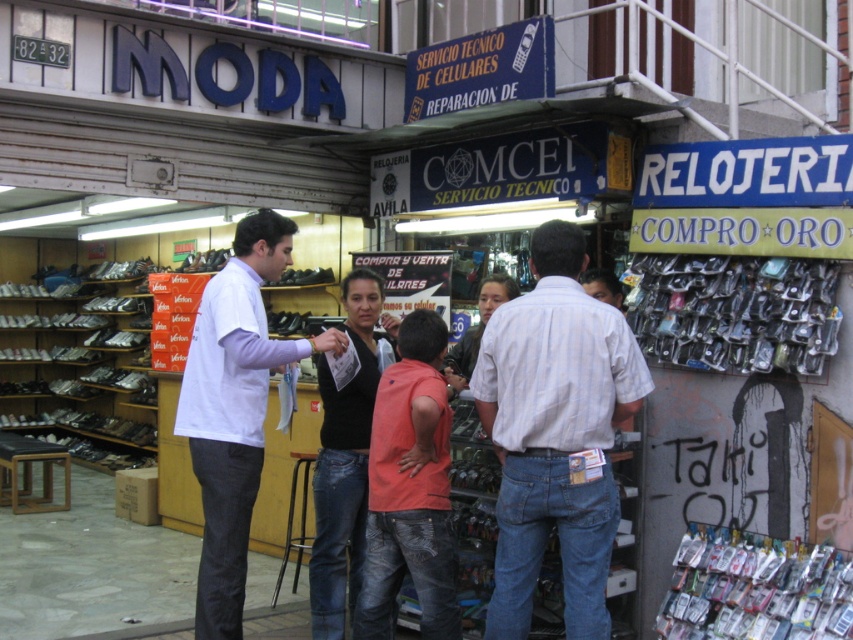
You are a customer at the MODA shop and want to buy a shirt. You see both the striped cotton shirt at center and the white cotton shirt at center. Which shirt takes up more space on the shelf?

The white cotton shirt at center takes up more space than the striped cotton shirt at center because the striped cotton shirt at center occupies less space than white cotton shirt at center.

Consider the image. You are a customer trying to decide between the white cotton shirt at center and the black matte shirt at center displayed in the shop window. Which shirt takes up more horizontal space?

The white cotton shirt at center might be wider than black matte shirt at center, so it likely takes up more horizontal space.

You are a customer trying to choose between two shirts displayed in a shop window. The striped cotton shirt at center and the white cotton shirt at center are both on display. Which shirt has a greater width?

The striped cotton shirt at center has a greater width than the white cotton shirt at center according to the description.